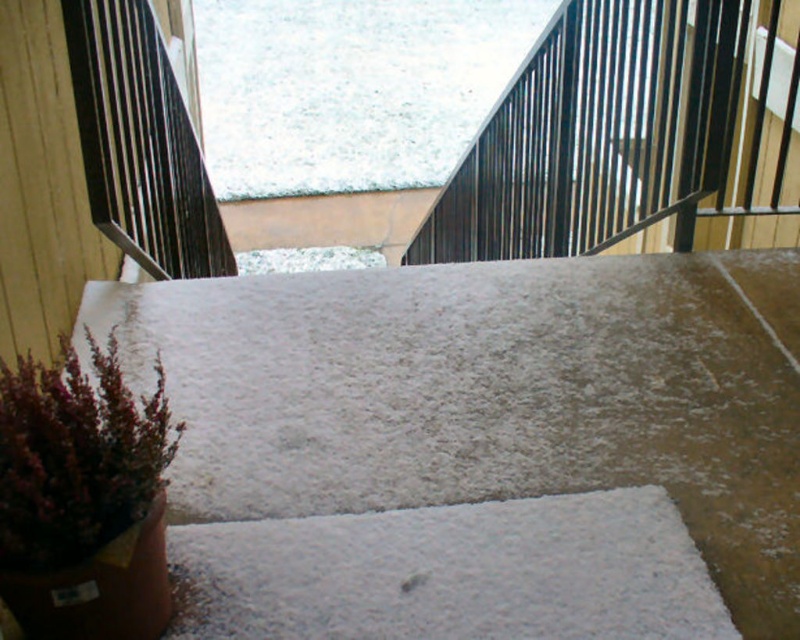
You are a delivery person trying to navigate a snowy path. You see a white textured ramp at lower left and a black metal rail at upper center. Which object is positioned to the left side of the other?

The white textured ramp at lower left is to the left of the black metal rail at upper center.

You are a delivery person trying to reach the front door located at the bottom of the snowy staircase. You have a box that needs to be placed on the white textured ramp at lower left. However, there is white fluffy snow at upper center in the way. Can you place the box on the ramp without disturbing the snow?

The white textured ramp at lower left is not as tall as the white fluffy snow at upper center, so you can place the box on the ramp without disturbing the snow since the ramp is lower than the snow.

You are standing on the white fluffy snow at upper center and want to go down to the white textured ramp at lower left. Which direction should you move to reach the ramp?

You should move downward to reach the white textured ramp at lower left because it is located below the white fluffy snow at upper center.